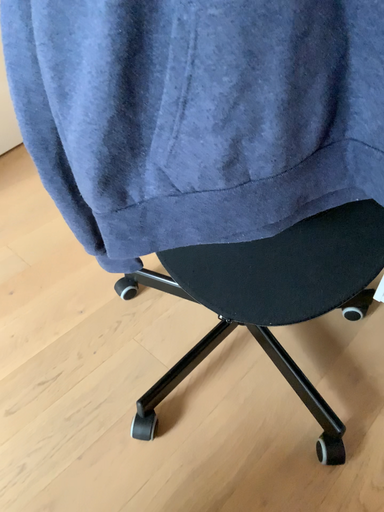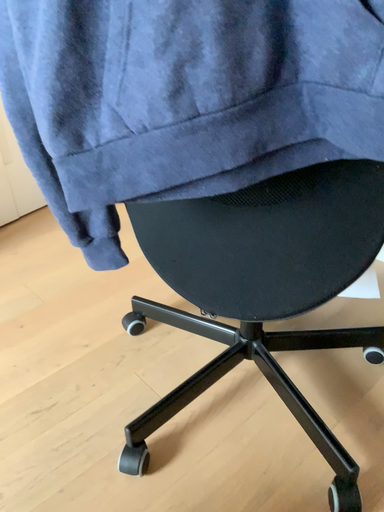
Question: Which way did the camera rotate in the video?

Choices:
 (A) rotated upward
 (B) rotated downward

Answer: (A)